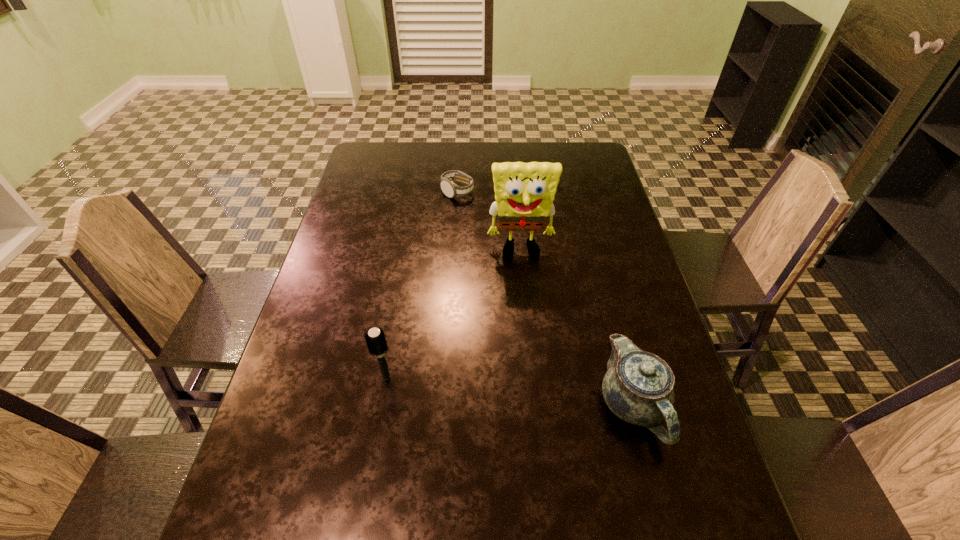
The image size is (960, 540). I want to click on vacant space located 0.370m on the face of the third object from right to left, so click(480, 280).

In order to click on free spot located 0.380m on the face of the third object from right to left in this screenshot , I will do `click(481, 282)`.

This screenshot has width=960, height=540. What are the coordinates of `free space located 0.120m on the face of the second farthest object` in the screenshot? It's located at (525, 294).

This screenshot has height=540, width=960. Identify the location of free space located 0.160m on the face of the second farthest object. (526, 306).

This screenshot has width=960, height=540. What are the coordinates of `vacant area situated on the face of the second farthest object` in the screenshot? It's located at (533, 383).

Identify the location of object that is at the right edge. (638, 387).

Locate an element on the screen. vacant space at the far edge of the desktop is located at coordinates (444, 144).

In the image, there is a desktop. Where is `free space at the near edge`? The height and width of the screenshot is (540, 960). free space at the near edge is located at coordinates (513, 506).

This screenshot has height=540, width=960. In the image, there is a desktop. What are the coordinates of `blank space at the left edge` in the screenshot? It's located at (351, 286).

Where is `vacant position at the right edge of the desktop`? This screenshot has height=540, width=960. vacant position at the right edge of the desktop is located at coordinates (591, 202).